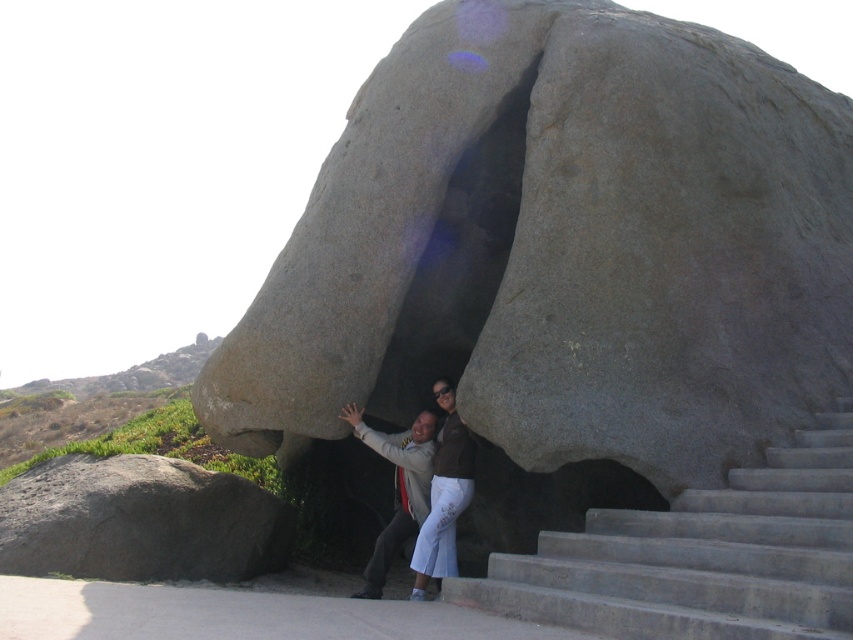
Looking at this image, you are standing at the point marked by the coordinate point (140, 522). Looking towards the gray rough boulder at lower left, which direction should you move to get closer to it?

Since the gray rough boulder at lower left is represented by the point (140, 522), you are already at the location of the boulder. Therefore, you don not need to move in any direction to get closer.

You are standing at the bottom of the concrete stairs at lower right and want to take a photo of the gray granite rock at center. Which direction should you face to get the best view of the rock?

Since the gray granite rock at center is to the left of the concrete stairs at lower right, you should face to the left to get the best view of the rock.

You are standing at the bottom of the concrete stairs at lower right and want to touch the gray granite rock at center. Is the rock above or below your current position?

The gray granite rock at center is located above the concrete stairs at lower right, so it is above your current position.